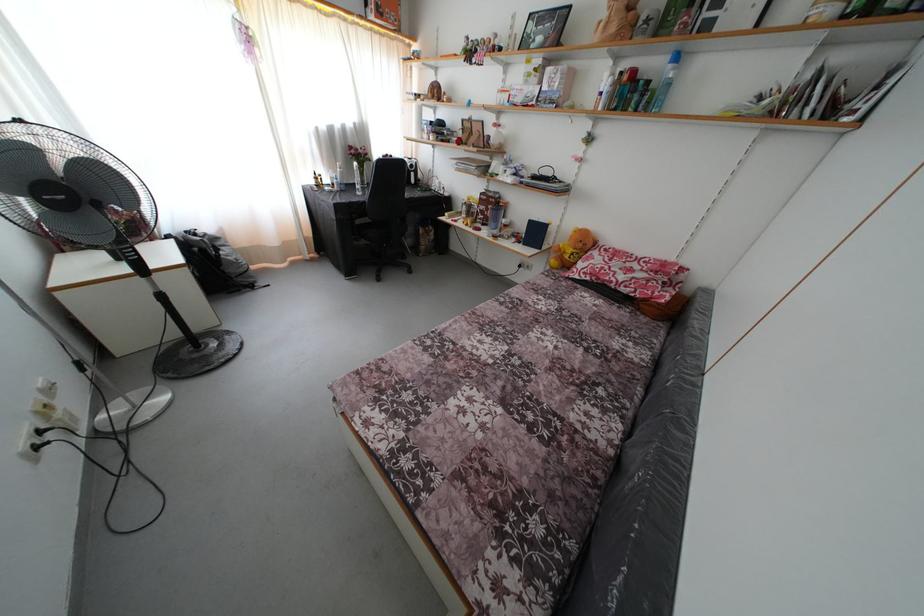
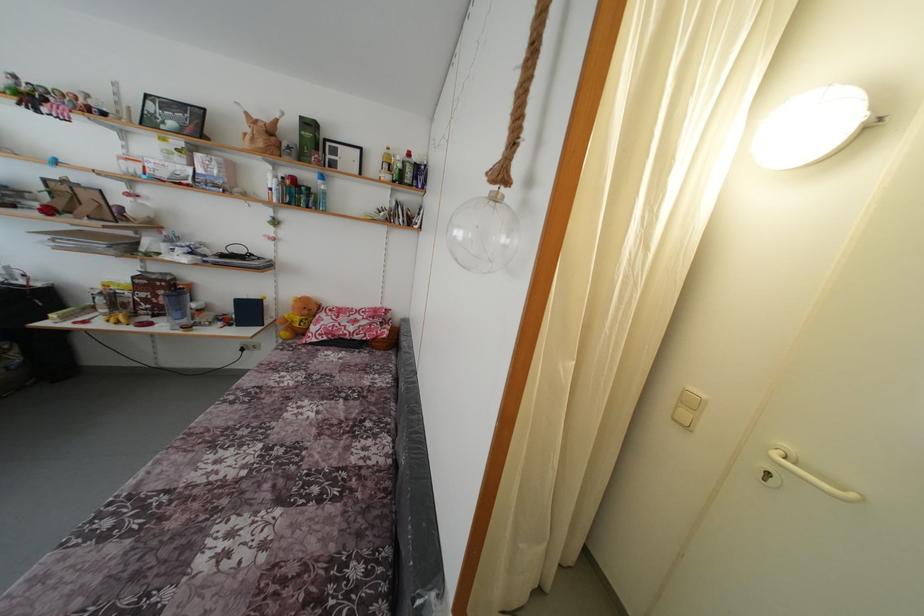
The point at (487, 214) is marked in the first image. Where is the corresponding point in the second image?

(149, 301)